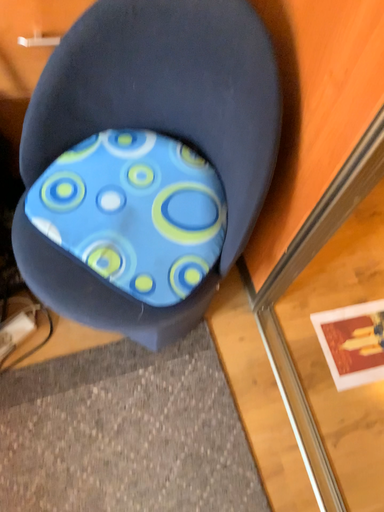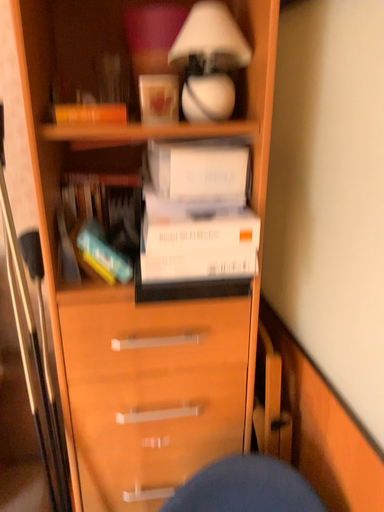
Question: Which way did the camera rotate in the video?

Choices:
 (A) rotated downward
 (B) rotated upward

Answer: (B)